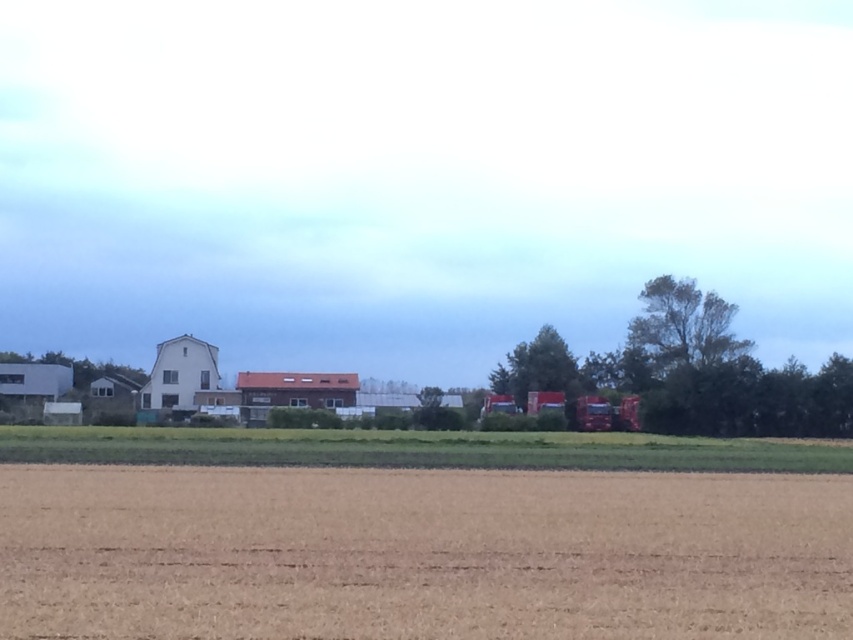
Based on the photo, who is more distant from viewer, (x=13, y=499) or (x=260, y=381)?

Point (x=260, y=381)

Can you confirm if brown matte wheat field at lower center is bigger than brown wooden barn at center?

Actually, brown matte wheat field at lower center might be smaller than brown wooden barn at center.

Does point (614, 632) lie in front of point (265, 408)?

Yes.

The height and width of the screenshot is (640, 853). In order to click on brown matte wheat field at lower center in this screenshot , I will do `click(421, 554)`.

Does green grass at center have a lesser height compared to white matte barn at center?

Yes.

Who is higher up, green grass at center or white matte barn at center?

white matte barn at center is higher up.

Identify the location of green grass at center. (418, 449).

Can you confirm if white matte barn at center is wider than brown wooden barn at center?

Incorrect, white matte barn at center's width does not surpass brown wooden barn at center's.

Does white matte barn at center have a lesser height compared to brown wooden barn at center?

Correct, white matte barn at center is not as tall as brown wooden barn at center.

Identify the location of white matte barn at center. (177, 378).

At what (x,y) coordinates should I click in order to perform the action: click on white matte barn at center. Please return your answer as a coordinate pair (x, y). Looking at the image, I should click on (177, 378).